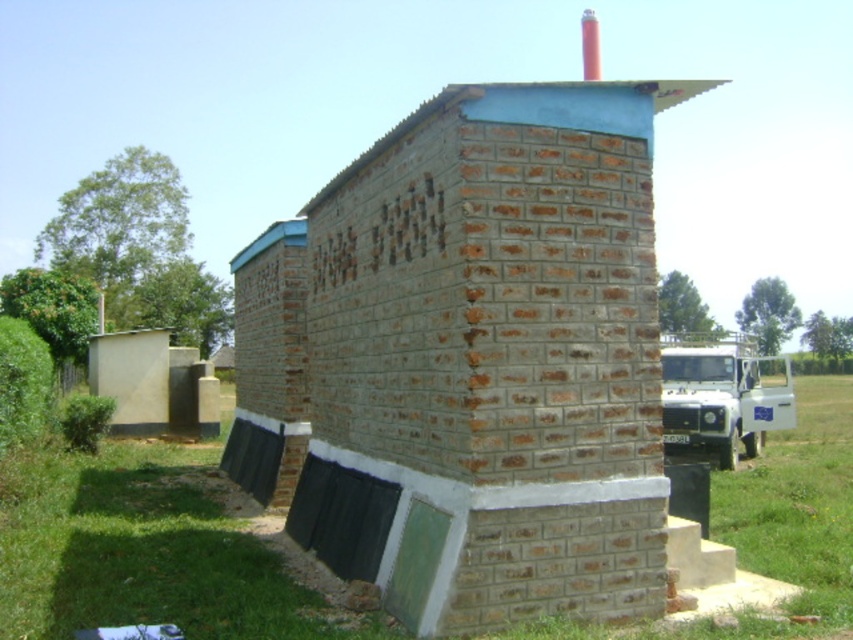
Between point (384, 554) and point (590, 58), which one is positioned in front?

Point (384, 554) is more forward.

Based on the photo, is brown brick hut at center closer to camera compared to smooth red chimney at upper center?

Yes, brown brick hut at center is in front of smooth red chimney at upper center.

Which is in front, point (505, 380) or point (595, 32)?

Point (505, 380) is in front.

Find the location of a particular element. brown brick hut at center is located at coordinates (482, 358).